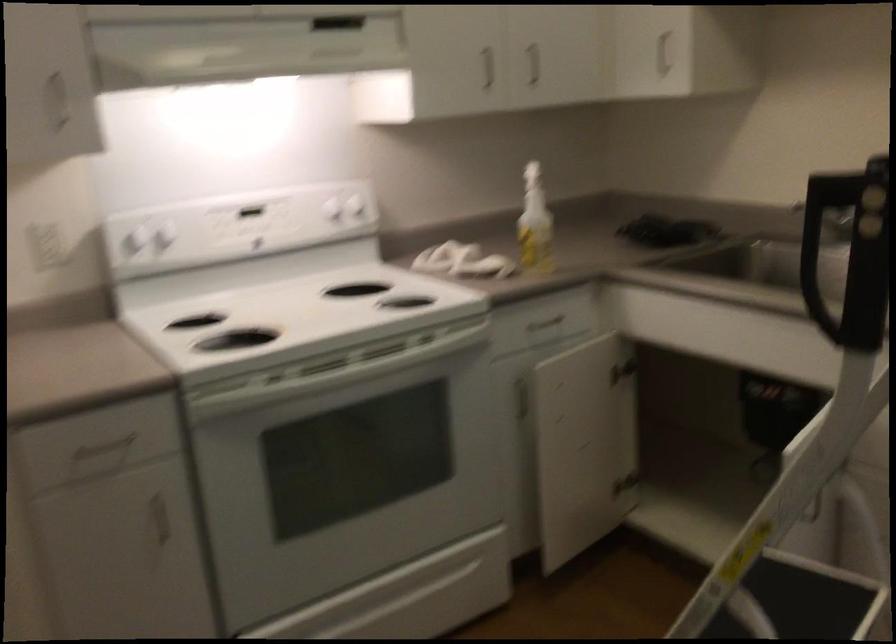
The image size is (896, 644). Describe the element at coordinates (574, 448) in the screenshot. I see `a white cabinet door` at that location.